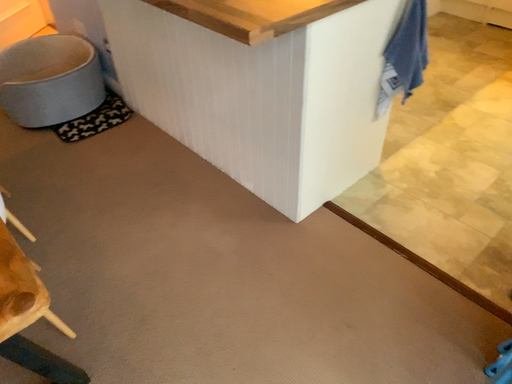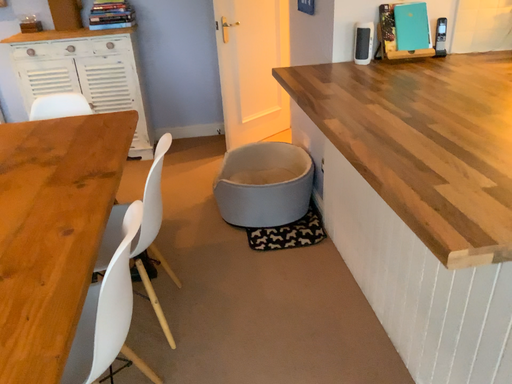
Question: How did the camera likely rotate when shooting the video?

Choices:
 (A) rotated left
 (B) rotated right

Answer: (A)